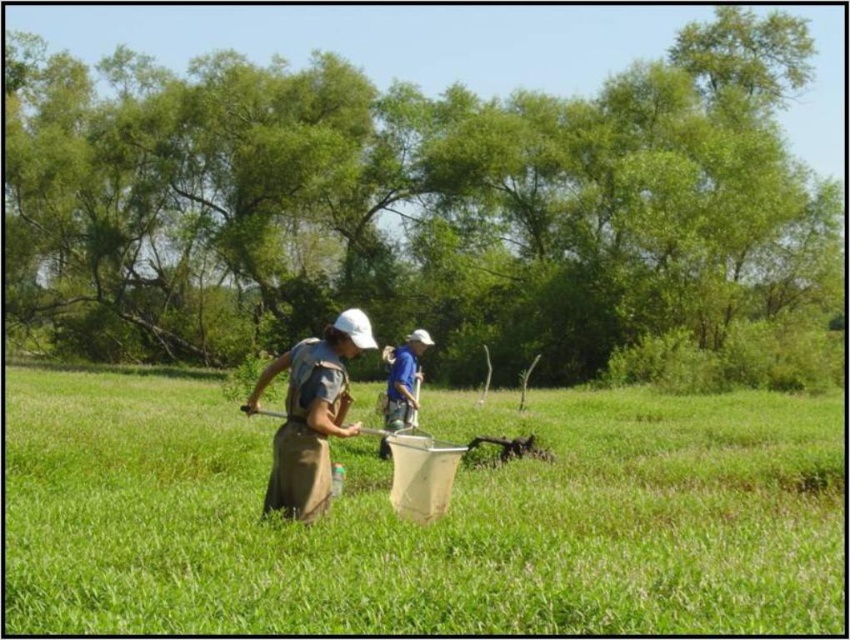
Is brown canvas apron at center bigger than metallic silver shovel at center?

Indeed, brown canvas apron at center has a larger size compared to metallic silver shovel at center.

What do you see at coordinates (310, 413) in the screenshot?
I see `brown canvas apron at center` at bounding box center [310, 413].

The width and height of the screenshot is (850, 640). Describe the element at coordinates (310, 413) in the screenshot. I see `brown canvas apron at center` at that location.

Where is `brown canvas apron at center`? The image size is (850, 640). brown canvas apron at center is located at coordinates (310, 413).

Is brown canvas apron at center behind blue fabric shirt at center?

No.

The width and height of the screenshot is (850, 640). In order to click on brown canvas apron at center in this screenshot , I will do `click(310, 413)`.

Is blue fabric shirt at center smaller than metallic silver shovel at center?

No, blue fabric shirt at center is not smaller than metallic silver shovel at center.

Looking at this image, who is lower down, blue fabric shirt at center or metallic silver shovel at center?

metallic silver shovel at center is lower down.

Describe the element at coordinates (403, 380) in the screenshot. I see `blue fabric shirt at center` at that location.

I want to click on blue fabric shirt at center, so click(x=403, y=380).